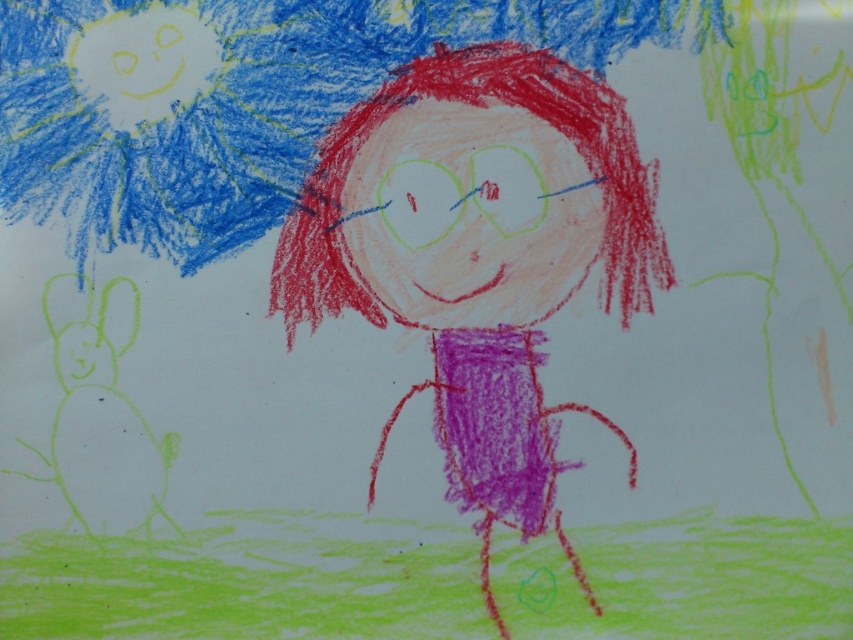
You are a fashion designer looking at this child drawing. You want to create a new outfit that combines the smooth purple dress at center with the blue textured umbrella at upper left. Which object should you make wider to ensure the dress is not too narrow compared to the umbrella?

The smooth purple dress at center is thinner than the blue textured umbrella at upper left, so to ensure the dress is not too narrow, you should make the smooth purple dress at center wider.

In the child drawing, there is a smooth purple dress at center and a blue textured umbrella at upper left. Which object is bigger?

The smooth purple dress at center is larger than the blue textured umbrella at upper left.